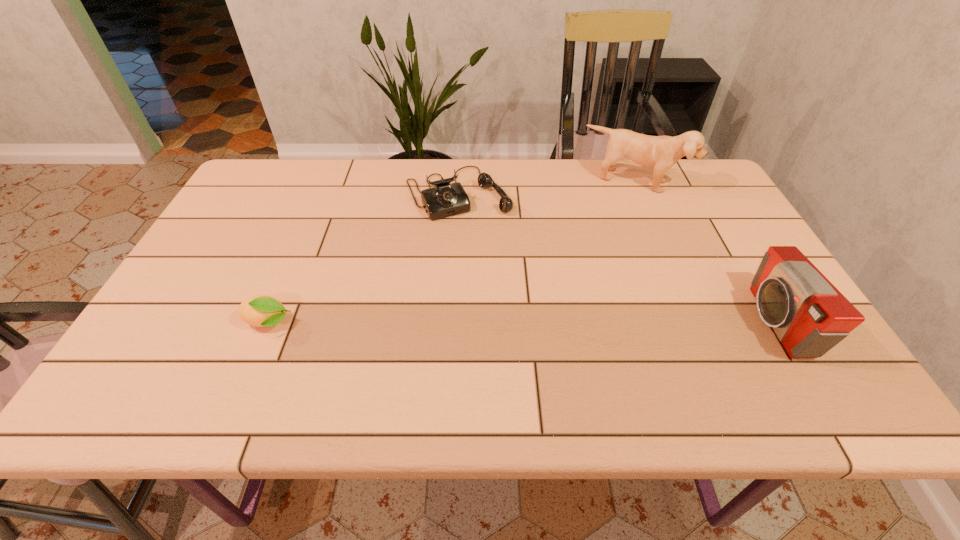
Locate an element on the screen. lemon is located at coordinates (263, 311).

This screenshot has height=540, width=960. I want to click on the leftmost object, so click(263, 311).

This screenshot has height=540, width=960. I want to click on the second tallest object, so click(x=809, y=315).

Find the location of a particular element. The image size is (960, 540). the second shortest object is located at coordinates (445, 199).

The height and width of the screenshot is (540, 960). In order to click on the third object from right to left in this screenshot , I will do `click(445, 199)`.

Find the location of `puppy`. puppy is located at coordinates (659, 152).

Identify the location of free location located 0.190m with leaves positioned above the leftmost object. (379, 323).

Where is `free space located 0.200m on the front-facing side of the second tallest object`? Image resolution: width=960 pixels, height=540 pixels. free space located 0.200m on the front-facing side of the second tallest object is located at coordinates (667, 321).

This screenshot has height=540, width=960. I want to click on free space located on the front-facing side of the second tallest object, so click(716, 321).

You are a GUI agent. You are given a task and a screenshot of the screen. Output one action in this format:
    pyautogui.click(x=<x>, y=<y>)
    Task: Click on the free space located on the front-facing side of the second tallest object
    This screenshot has height=540, width=960.
    Given the screenshot: What is the action you would take?
    pyautogui.click(x=649, y=321)